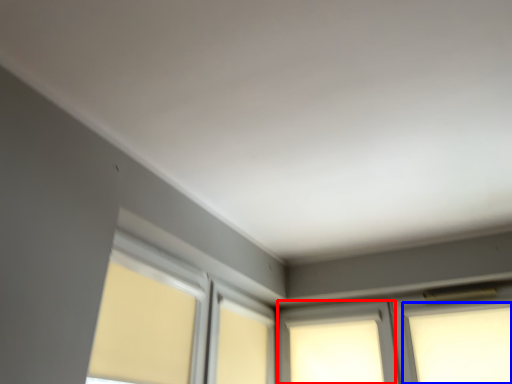
Question: Among these objects, which one is farthest to the camera, window (highlighted by a red box) or window (highlighted by a blue box)?

Choices:
 (A) window
 (B) window

Answer: (A)